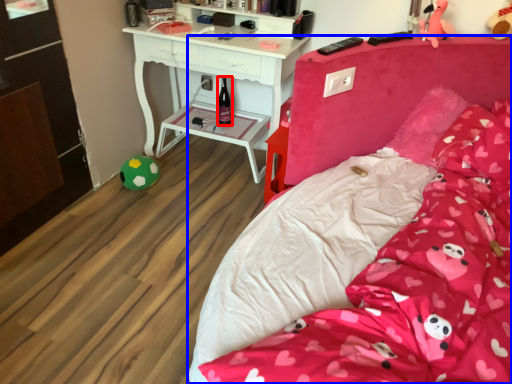
Question: Which object is further to the camera taking this photo, bottle (highlighted by a red box) or bed (highlighted by a blue box)?

Choices:
 (A) bottle
 (B) bed

Answer: (A)